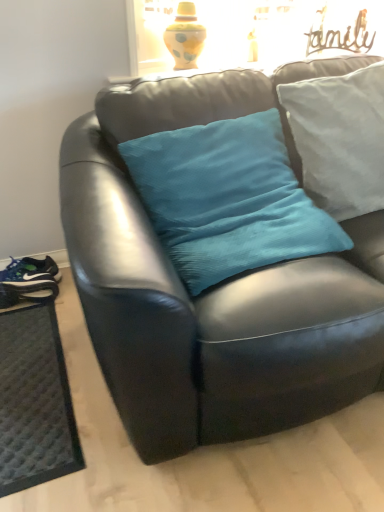
Question: Is dark gray textured mat at lower left at the back of matte black couch at center?

Choices:
 (A) yes
 (B) no

Answer: (B)

Question: From the image's perspective, is matte black couch at center over dark gray textured mat at lower left?

Choices:
 (A) no
 (B) yes

Answer: (B)

Question: Is matte black couch at center shorter than dark gray textured mat at lower left?

Choices:
 (A) yes
 (B) no

Answer: (B)

Question: Does matte black couch at center lie behind dark gray textured mat at lower left?

Choices:
 (A) no
 (B) yes

Answer: (A)

Question: Can you confirm if matte black couch at center is wider than dark gray textured mat at lower left?

Choices:
 (A) no
 (B) yes

Answer: (B)

Question: From the image's perspective, is matte black running shoe at lower left above or below teal fabric pillow at center, which appears as the 2th pillow when viewed from the left?

Choices:
 (A) above
 (B) below

Answer: (B)

Question: Considering the positions of matte black running shoe at lower left and teal fabric pillow at center, the 1th pillow from the right, in the image, is matte black running shoe at lower left wider or thinner than teal fabric pillow at center, the 1th pillow from the right,?

Choices:
 (A) wide
 (B) thin

Answer: (A)

Question: Considering the positions of matte black running shoe at lower left and teal fabric pillow at center, which appears as the 2th pillow when viewed from the left, in the image, is matte black running shoe at lower left taller or shorter than teal fabric pillow at center, which appears as the 2th pillow when viewed from the left,?

Choices:
 (A) short
 (B) tall

Answer: (A)

Question: From a real-world perspective, is matte black running shoe at lower left above or below teal fabric pillow at center, the 1th pillow from the right?

Choices:
 (A) below
 (B) above

Answer: (A)

Question: Is teal fabric pillow at center, which appears as the second pillow when viewed from the right, situated inside dark gray textured mat at lower left or outside?

Choices:
 (A) outside
 (B) inside

Answer: (A)

Question: Considering the positions of teal fabric pillow at center, which appears as the second pillow when viewed from the right, and dark gray textured mat at lower left in the image, is teal fabric pillow at center, which appears as the second pillow when viewed from the right, wider or thinner than dark gray textured mat at lower left?

Choices:
 (A) wide
 (B) thin

Answer: (B)

Question: From a real-world perspective, relative to dark gray textured mat at lower left, is teal fabric pillow at center, which appears as the second pillow when viewed from the right, vertically above or below?

Choices:
 (A) below
 (B) above

Answer: (B)

Question: Does point (198, 125) appear closer or farther from the camera than point (19, 466)?

Choices:
 (A) farther
 (B) closer

Answer: (A)

Question: Choose the correct answer: Is matte black couch at center inside dark gray textured mat at lower left or outside it?

Choices:
 (A) inside
 (B) outside

Answer: (B)

Question: Looking at their shapes, would you say matte black couch at center is wider or thinner than dark gray textured mat at lower left?

Choices:
 (A) thin
 (B) wide

Answer: (B)